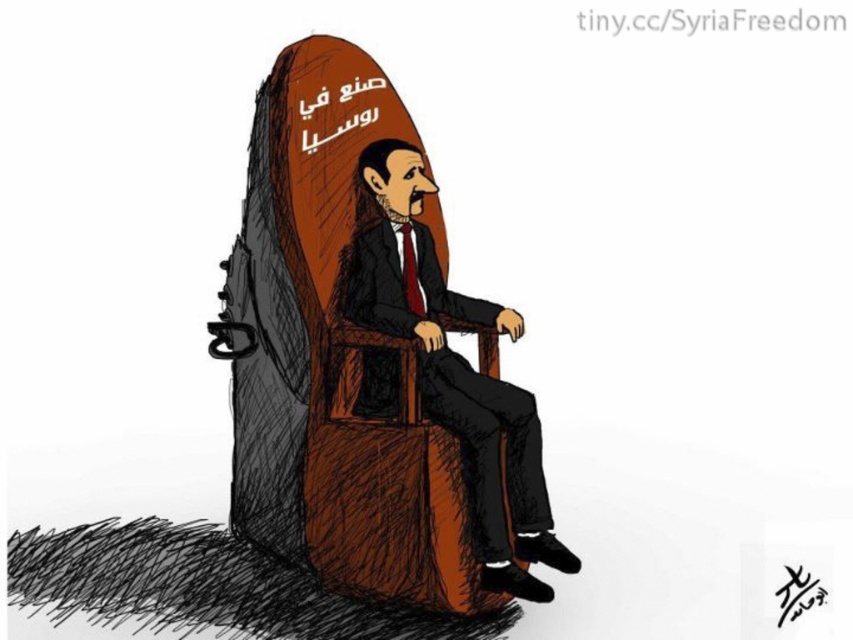
Question: Which object is farther from the camera taking this photo?

Choices:
 (A) black ink signature at center
 (B) smooth brown chair at center
 (C) brown wooden armchair at center

Answer: (A)

Question: Based on their relative distances, which object is nearer to the black ink signature at center?

Choices:
 (A) brown wooden armchair at center
 (B) smooth brown chair at center

Answer: (B)

Question: Does smooth brown chair at center lie behind black ink signature at center?

Choices:
 (A) yes
 (B) no

Answer: (B)

Question: Considering the real-world distances, which object is farthest from the brown wooden armchair at center?

Choices:
 (A) smooth brown chair at center
 (B) black ink signature at center

Answer: (B)

Question: Can you confirm if brown wooden armchair at center is bigger than smooth brown chair at center?

Choices:
 (A) no
 (B) yes

Answer: (B)

Question: Does brown wooden armchair at center appear on the right side of black ink signature at center?

Choices:
 (A) no
 (B) yes

Answer: (A)